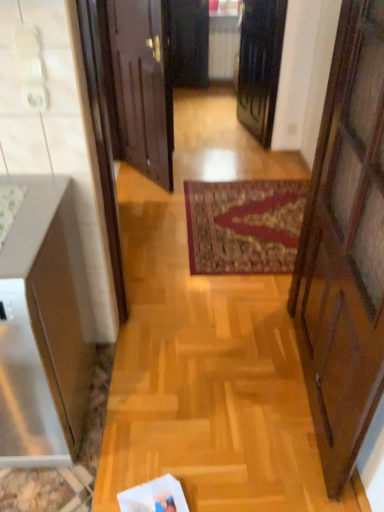
Question: Considering the relative sizes of matte white cabinet at left and wooden door at center, the 1th door when ordered from left to right, in the image provided, is matte white cabinet at left shorter than wooden door at center, the 1th door when ordered from left to right,?

Choices:
 (A) yes
 (B) no

Answer: (A)

Question: From a real-world perspective, is matte white cabinet at left physically above wooden door at center, acting as the 2th door starting from the right?

Choices:
 (A) no
 (B) yes

Answer: (A)

Question: From the image's perspective, is matte white cabinet at left under wooden door at center, acting as the 2th door starting from the right?

Choices:
 (A) yes
 (B) no

Answer: (A)

Question: Does matte white cabinet at left have a smaller size compared to wooden door at center, the 1th door when ordered from left to right?

Choices:
 (A) yes
 (B) no

Answer: (B)

Question: Can you confirm if matte white cabinet at left is thinner than wooden door at center, the 1th door when ordered from left to right?

Choices:
 (A) yes
 (B) no

Answer: (B)

Question: From a real-world perspective, is matte white cabinet at left above or below black glossy door at center, which ranks as the second door in left-to-right order?

Choices:
 (A) above
 (B) below

Answer: (B)

Question: Would you say matte white cabinet at left is to the left or to the right of black glossy door at center, which ranks as the second door in left-to-right order, in the picture?

Choices:
 (A) right
 (B) left

Answer: (B)

Question: Is point (72, 386) positioned closer to the camera than point (253, 133)?

Choices:
 (A) closer
 (B) farther

Answer: (A)

Question: From the image's perspective, relative to black glossy door at center, which ranks as the second door in left-to-right order, is matte white cabinet at left above or below?

Choices:
 (A) above
 (B) below

Answer: (B)

Question: Would you say matte white cabinet at left is to the left or to the right of wooden door at center, acting as the 2th door starting from the right, in the picture?

Choices:
 (A) left
 (B) right

Answer: (A)

Question: From a real-world perspective, is matte white cabinet at left physically located above or below wooden door at center, the 1th door when ordered from left to right?

Choices:
 (A) below
 (B) above

Answer: (A)

Question: From their relative heights in the image, would you say matte white cabinet at left is taller or shorter than wooden door at center, acting as the 2th door starting from the right?

Choices:
 (A) short
 (B) tall

Answer: (A)

Question: Considering the positions of matte white cabinet at left and wooden door at center, the 1th door when ordered from left to right, in the image, is matte white cabinet at left wider or thinner than wooden door at center, the 1th door when ordered from left to right,?

Choices:
 (A) thin
 (B) wide

Answer: (B)

Question: Choose the correct answer: Is wooden door at center, the 1th door when ordered from left to right, inside black glossy door at center, the first door from the right, or outside it?

Choices:
 (A) outside
 (B) inside

Answer: (A)

Question: Considering their positions, is wooden door at center, acting as the 2th door starting from the right, located in front of or behind black glossy door at center, which ranks as the second door in left-to-right order?

Choices:
 (A) front
 (B) behind

Answer: (A)